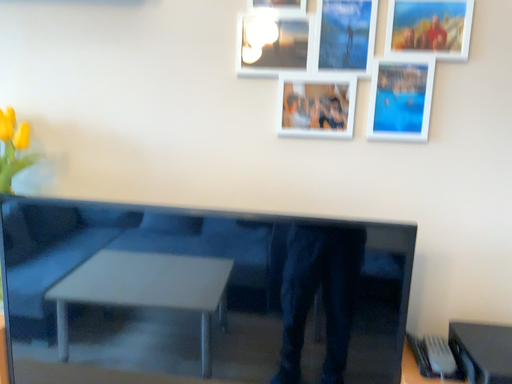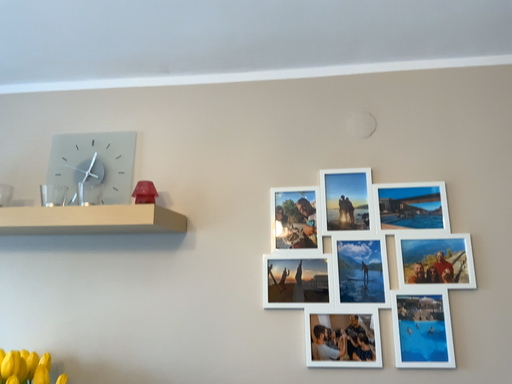
Question: How did the camera likely rotate when shooting the video?

Choices:
 (A) rotated upward
 (B) rotated downward

Answer: (A)